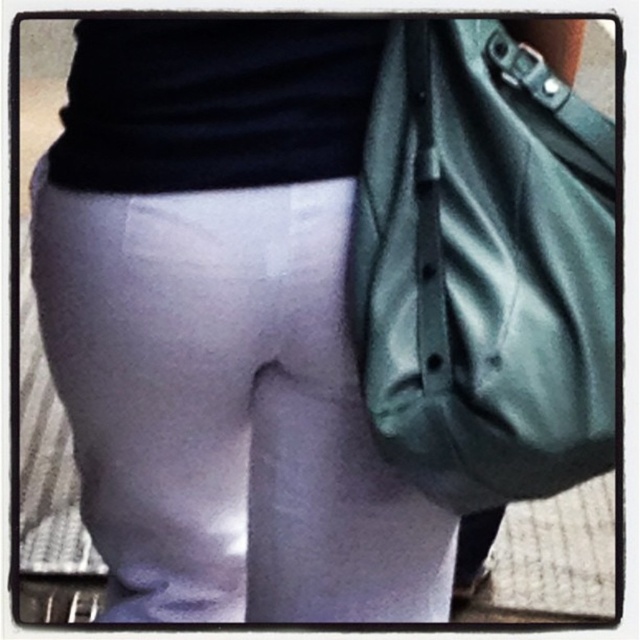
You are a photographer setting up for a photoshoot. You need to place a small prop between the matte white leggings at center and the matte green shoulder bag at right. Based on their positions, where should you place the prop to ensure it is centered between them?

The prop should be placed between the matte white leggings at center and the matte green shoulder bag at right, aligning it with the midpoint between their positions since the leggings are on the left and the bag is on the right.

You are a fashion designer analyzing the image of a person wearing matte white leggings at center and carrying a matte green shoulder bag at right. Which item takes up more space in the image?

The matte white leggings at center takes up more space in the image as it has a larger size compared to the matte green shoulder bag at right.

You are a photographer setting up a shoot in an outdoor location. You have to position the matte white leggings at center and the matte green shoulder bag at right in a way that maintains their visibility. Given their sizes, which object should be placed closer to the camera to ensure both are clearly visible in the photo?

The matte green shoulder bag at right should be placed closer to the camera because the matte white leggings at center has a greater height and will naturally appear larger in the frame, while the bag is smaller and needs to be nearer to maintain visibility.